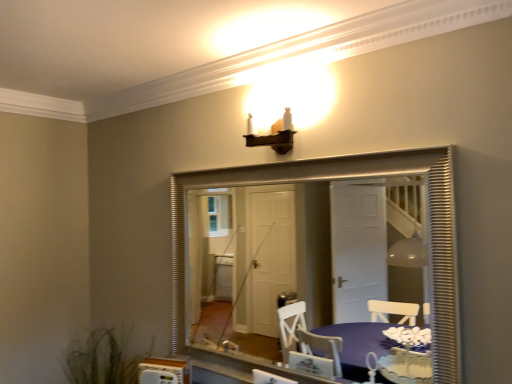
Question: Are purple fabric table at lower center and silver textured mirror at center located far from each other?

Choices:
 (A) no
 (B) yes

Answer: (B)

Question: From the image's perspective, is purple fabric table at lower center beneath silver textured mirror at center?

Choices:
 (A) no
 (B) yes

Answer: (B)

Question: Considering the relative sizes of purple fabric table at lower center and silver textured mirror at center in the image provided, is purple fabric table at lower center shorter than silver textured mirror at center?

Choices:
 (A) yes
 (B) no

Answer: (A)

Question: Does purple fabric table at lower center appear on the right side of silver textured mirror at center?

Choices:
 (A) no
 (B) yes

Answer: (B)

Question: Would you say silver textured mirror at center is part of purple fabric table at lower center's contents?

Choices:
 (A) no
 (B) yes

Answer: (A)

Question: Is purple fabric table at lower center with silver textured mirror at center?

Choices:
 (A) no
 (B) yes

Answer: (A)

Question: Is purple fabric table at lower center oriented towards green grass at lower left?

Choices:
 (A) no
 (B) yes

Answer: (A)

Question: Is purple fabric table at lower center smaller than green grass at lower left?

Choices:
 (A) yes
 (B) no

Answer: (A)

Question: Considering the relative positions of purple fabric table at lower center and green grass at lower left in the image provided, is purple fabric table at lower center to the right of green grass at lower left from the viewer's perspective?

Choices:
 (A) yes
 (B) no

Answer: (A)

Question: From a real-world perspective, is purple fabric table at lower center physically below green grass at lower left?

Choices:
 (A) no
 (B) yes

Answer: (A)

Question: Can you confirm if purple fabric table at lower center is thinner than green grass at lower left?

Choices:
 (A) no
 (B) yes

Answer: (B)

Question: From the image's perspective, is purple fabric table at lower center on green grass at lower left?

Choices:
 (A) yes
 (B) no

Answer: (A)

Question: Is green grass at lower left surrounded by silver textured mirror at center?

Choices:
 (A) yes
 (B) no

Answer: (B)